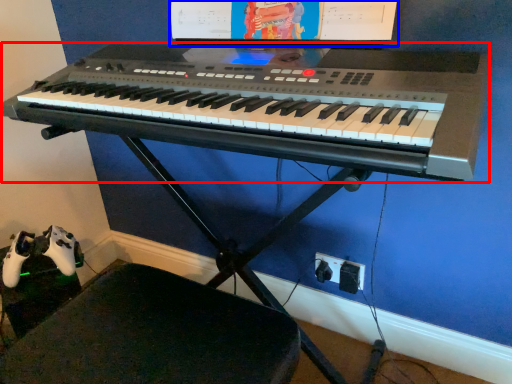
Question: Which object is closer to the camera taking this photo, musical keyboard (highlighted by a red box) or computer monitor (highlighted by a blue box)?

Choices:
 (A) musical keyboard
 (B) computer monitor

Answer: (A)